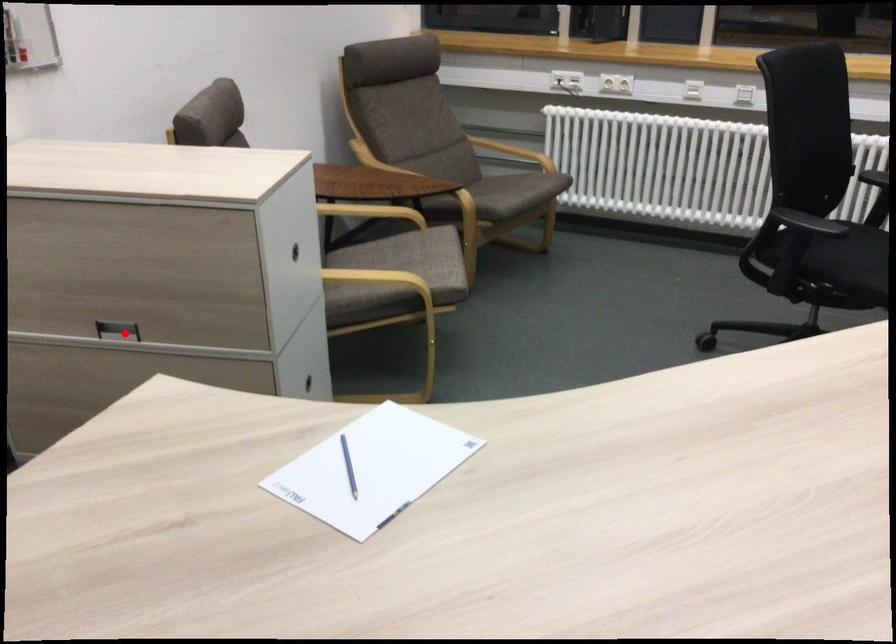
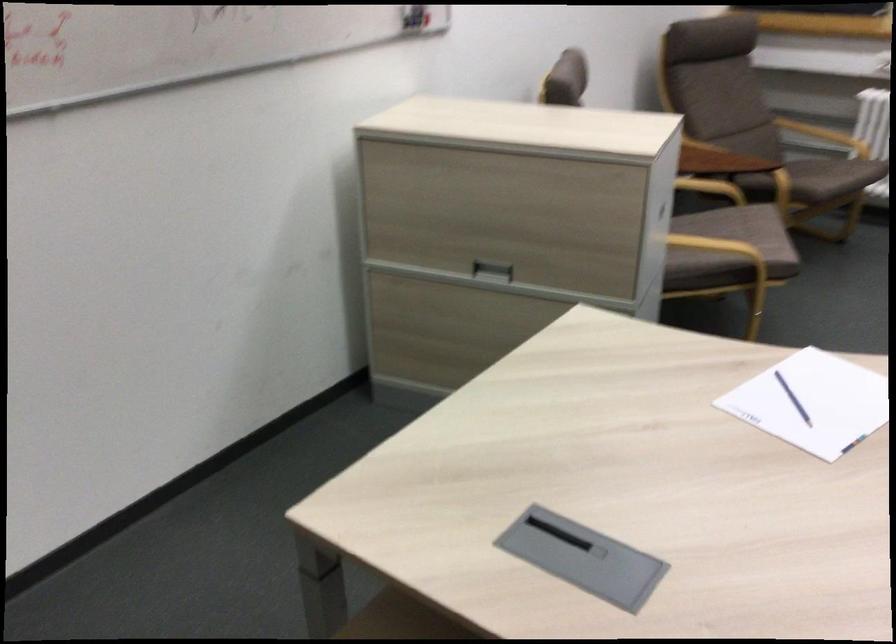
Find the pixel in the second image that matches the highlighted location in the first image.

(492, 270)